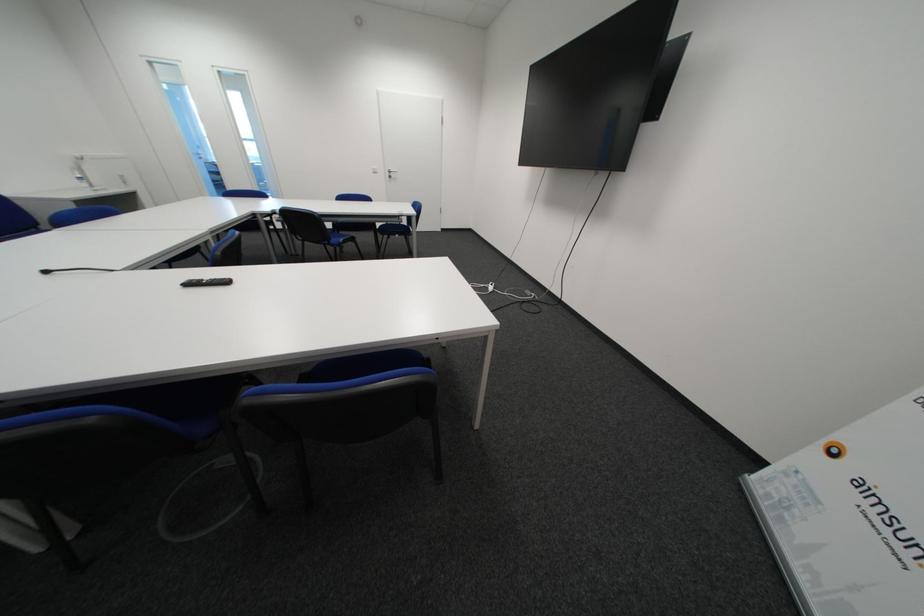
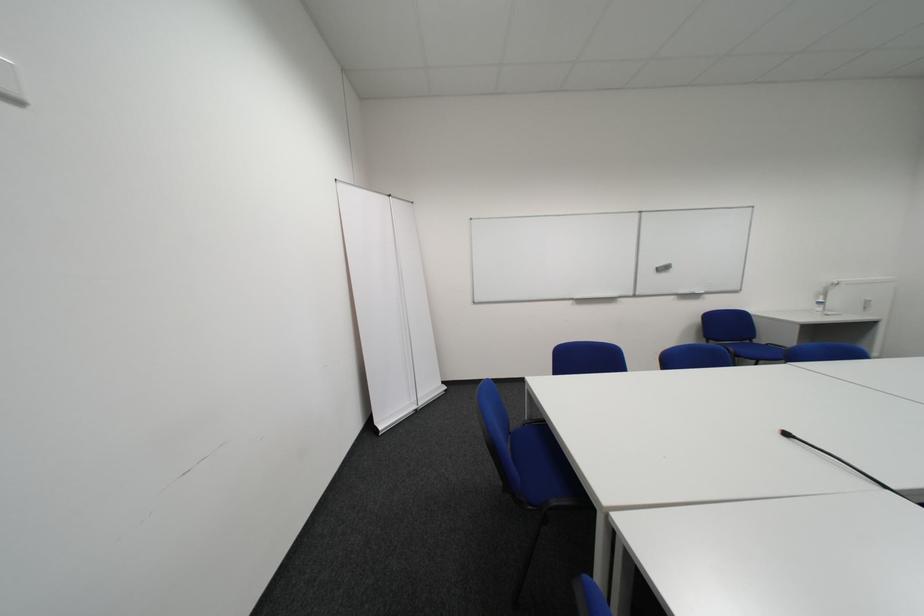
Question: The camera is either moving clockwise (left) or counter-clockwise (right) around the object. The first image is from the beginning of the video and the second image is from the end. Is the camera moving left or right when shooting the video?

Choices:
 (A) Left
 (B) Right

Answer: (B)